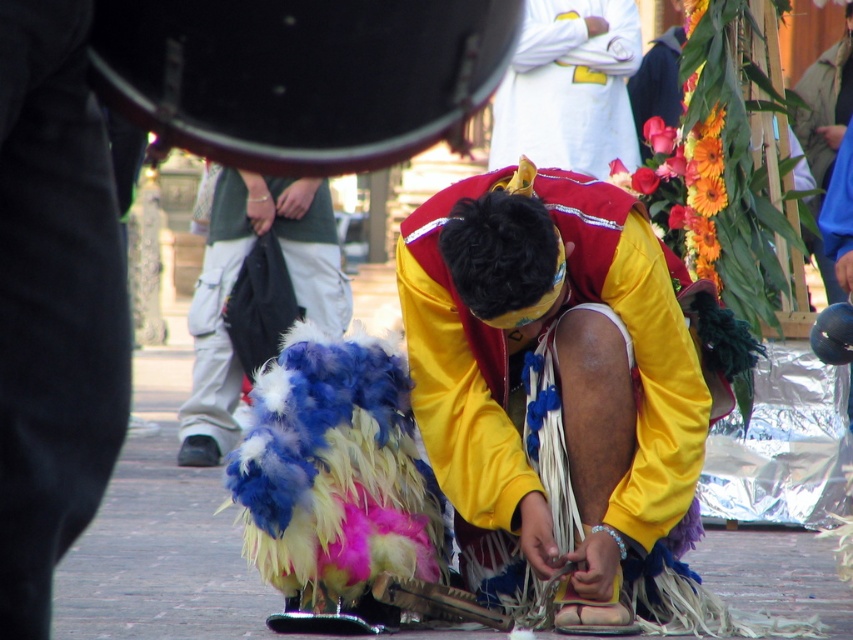
Question: Which object is closer to the camera taking this photo?

Choices:
 (A) yellow fabric at center
 (B) feathered costume at center

Answer: (B)

Question: Can you confirm if yellow fabric at center is positioned to the left of white cotton shirt at upper center?

Choices:
 (A) yes
 (B) no

Answer: (A)

Question: Which object is the farthest from the white cotton shirt at upper center?

Choices:
 (A) yellow fabric at center
 (B) feathered costume at center

Answer: (A)

Question: Is yellow fabric at center bigger than feathered costume at center?

Choices:
 (A) yes
 (B) no

Answer: (B)

Question: Which is nearer to the feathered costume at center?

Choices:
 (A) white cotton shirt at upper center
 (B) yellow fabric at center

Answer: (A)

Question: Does yellow fabric at center have a smaller size compared to feathered costume at center?

Choices:
 (A) yes
 (B) no

Answer: (A)